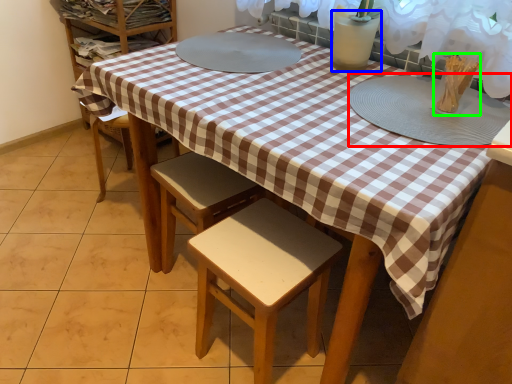
Question: Estimate the real-world distances between objects in this image. Which object is closer to platter (highlighted by a red box), glass vase (highlighted by a blue box) or tableware (highlighted by a green box)?

Choices:
 (A) glass vase
 (B) tableware

Answer: (B)